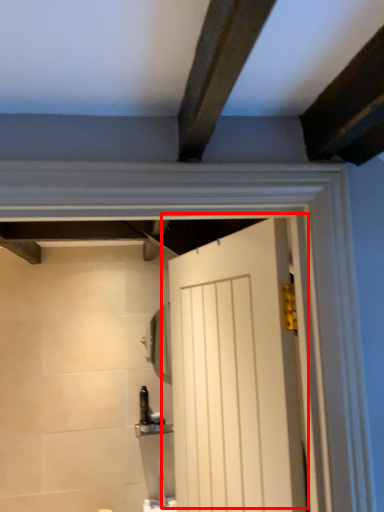
Question: From the image's perspective, what is the correct spatial positioning of door (annotated by the red box) in reference to mirror?

Choices:
 (A) above
 (B) below

Answer: (A)